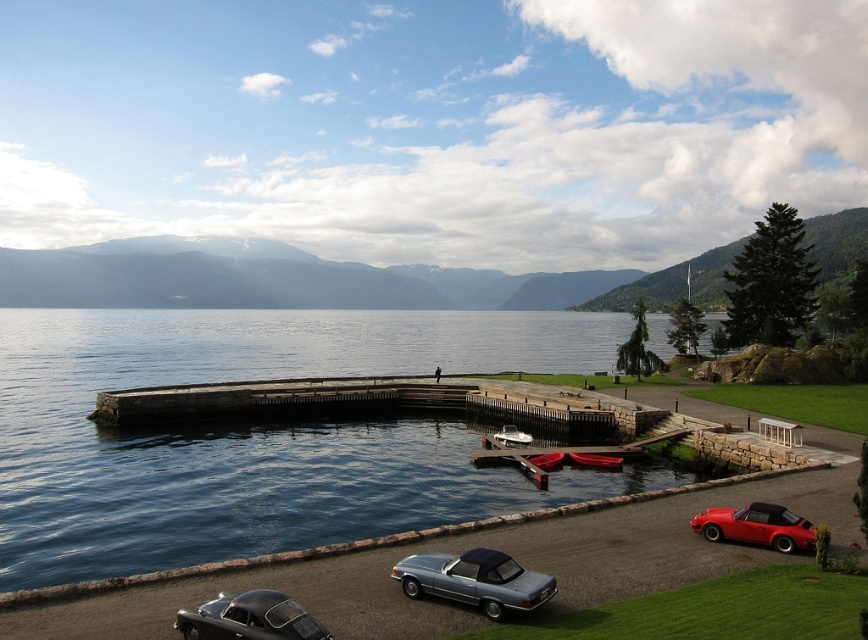
Question: Which of the following is the farthest from the observer?

Choices:
 (A) white glossy boat at center
 (B) metallic silver convertible at lower center
 (C) wooden canoe at lower center
 (D) red plastic boat at lower center

Answer: (A)

Question: Does metallic silver convertible at lower center appear on the right side of wooden canoe at lower center?

Choices:
 (A) yes
 (B) no

Answer: (B)

Question: Considering the relative positions of metallic silver convertible at lower center and shiny red convertible at lower right in the image provided, where is metallic silver convertible at lower center located with respect to shiny red convertible at lower right?

Choices:
 (A) left
 (B) right

Answer: (A)

Question: Which object appears farthest from the camera in this image?

Choices:
 (A) wooden canoe at lower center
 (B) shiny black car at lower left
 (C) white glossy boat at center
 (D) smooth concrete dock at center

Answer: (D)

Question: Is metallic silver convertible at lower center thinner than white glossy boat at center?

Choices:
 (A) yes
 (B) no

Answer: (B)

Question: Which point is closer to the camera?

Choices:
 (A) (303, 634)
 (B) (527, 596)

Answer: (A)